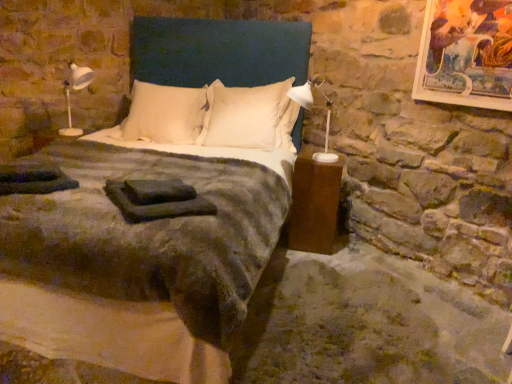
Image resolution: width=512 pixels, height=384 pixels. Describe the element at coordinates (163, 114) in the screenshot. I see `white soft pillow at center, the 1th pillow in the left-to-right sequence` at that location.

What do you see at coordinates (310, 108) in the screenshot? I see `white plastic lamp at right, the 2th bedside lamp from the left` at bounding box center [310, 108].

Describe the element at coordinates (466, 54) in the screenshot. This screenshot has height=384, width=512. I see `metallic gold picture frame at upper right` at that location.

The height and width of the screenshot is (384, 512). In order to click on velvet dark green bed at center in this screenshot , I will do `click(135, 264)`.

Where is `white soft pillow at center, the 1th pillow in the left-to-right sequence`? This screenshot has width=512, height=384. white soft pillow at center, the 1th pillow in the left-to-right sequence is located at coordinates (163, 114).

Would you consider brown matte nightstand at right to be distant from metallic gold picture frame at upper right?

Yes, brown matte nightstand at right is far from metallic gold picture frame at upper right.

Consider the image. Is metallic gold picture frame at upper right completely or partially inside brown matte nightstand at right?

No, metallic gold picture frame at upper right is not inside brown matte nightstand at right.

Who is bigger, brown matte nightstand at right or metallic gold picture frame at upper right?

brown matte nightstand at right.

How far apart are brown matte nightstand at right and metallic gold picture frame at upper right?

They are 1.01 meters apart.

Who is shorter, metallic gold picture frame at upper right or white plastic lamp at right, the 2th bedside lamp from the left?

white plastic lamp at right, the 2th bedside lamp from the left.

The height and width of the screenshot is (384, 512). Identify the location of picture frame above the white plastic lamp at right, the 2th bedside lamp from the left (from the image's perspective). (x=466, y=54).

Is point (416, 89) farther from camera compared to point (325, 154)?

No, (416, 89) is in front of (325, 154).

Who is more distant, brown matte nightstand at right or dark green fabric at center?

Positioned behind is brown matte nightstand at right.

What are the coordinates of `nightstand behind the dark green fabric at center` in the screenshot? It's located at (315, 204).

From a real-world perspective, is brown matte nightstand at right above or below dark green fabric at center?

In terms of real-world spatial position, brown matte nightstand at right is below dark green fabric at center.

Is brown matte nightstand at right bigger than dark green fabric at center?

Yes, brown matte nightstand at right is bigger than dark green fabric at center.

Which object is positioned more to the left, white plastic lamp at left, placed as the 1th bedside lamp when sorted from left to right, or white soft pillow at center, which is the 2th pillow in left-to-right order?

white plastic lamp at left, placed as the 1th bedside lamp when sorted from left to right.

Is white plastic lamp at left, the 2th bedside lamp from the right, next to white soft pillow at center, which is the 2th pillow in left-to-right order, and touching it?

No, white plastic lamp at left, the 2th bedside lamp from the right, is not making contact with white soft pillow at center, which is the 2th pillow in left-to-right order.

Considering the relative sizes of white plastic lamp at left, placed as the 1th bedside lamp when sorted from left to right, and white soft pillow at center, marked as the 1th pillow in a right-to-left arrangement, in the image provided, is white plastic lamp at left, placed as the 1th bedside lamp when sorted from left to right, taller than white soft pillow at center, marked as the 1th pillow in a right-to-left arrangement,?

In fact, white plastic lamp at left, placed as the 1th bedside lamp when sorted from left to right, may be shorter than white soft pillow at center, marked as the 1th pillow in a right-to-left arrangement.

Is dark green fabric at center to the right of white soft pillow at center, marked as the 1th pillow in a right-to-left arrangement, from the viewer's perspective?

No, dark green fabric at center is not to the right of white soft pillow at center, marked as the 1th pillow in a right-to-left arrangement.

From a real-world perspective, which is physically above, dark green fabric at center or white soft pillow at center, marked as the 1th pillow in a right-to-left arrangement?

From a 3D spatial view, white soft pillow at center, marked as the 1th pillow in a right-to-left arrangement, is above.

Starting from the dark green fabric at center, which pillow is the 1st one behind? Please provide its 2D coordinates.

[(250, 117)]

Does point (116, 203) lie in front of point (240, 129)?

Yes.

Is brown matte nightstand at right not close to velvet dark green bed at center?

They are positioned close to each other.

Considering the relative sizes of brown matte nightstand at right and velvet dark green bed at center in the image provided, is brown matte nightstand at right bigger than velvet dark green bed at center?

Actually, brown matte nightstand at right might be smaller than velvet dark green bed at center.

Is brown matte nightstand at right not within velvet dark green bed at center?

No, brown matte nightstand at right is inside or overlapping with velvet dark green bed at center.

Which is more to the left, white soft pillow at center, marked as the 2th pillow in a right-to-left arrangement, or dark blue fabric headboard at center?

white soft pillow at center, marked as the 2th pillow in a right-to-left arrangement.

Is white soft pillow at center, marked as the 2th pillow in a right-to-left arrangement, oriented away from dark blue fabric headboard at center?

That's not correct — white soft pillow at center, marked as the 2th pillow in a right-to-left arrangement, is not looking away from dark blue fabric headboard at center.

From the image's perspective, is white soft pillow at center, marked as the 2th pillow in a right-to-left arrangement, positioned above or below dark blue fabric headboard at center?

Based on their image positions, white soft pillow at center, marked as the 2th pillow in a right-to-left arrangement, is located above dark blue fabric headboard at center.

Does point (196, 140) appear closer or farther from the camera than point (246, 33)?

Point (196, 140) is closer to the camera than point (246, 33).

The width and height of the screenshot is (512, 384). I want to click on nightstand below the metallic gold picture frame at upper right (from the image's perspective), so click(315, 204).

You are a GUI agent. You are given a task and a screenshot of the screen. Output one action in this format:
    pyautogui.click(x=<x>, y=<y>)
    Task: Click on the picture frame on the right of white plastic lamp at right, the 2th bedside lamp from the left
    The image size is (512, 384).
    Given the screenshot: What is the action you would take?
    pyautogui.click(x=466, y=54)

Based on their spatial positions, is dark green fabric at center or metallic gold picture frame at upper right closer to dark blue fabric headboard at center?

metallic gold picture frame at upper right is closer to dark blue fabric headboard at center.

From the image, which object appears to be farther from metallic gold picture frame at upper right, velvet dark green bed at center or brown matte nightstand at right?

velvet dark green bed at center is further to metallic gold picture frame at upper right.

Estimate the real-world distances between objects in this image. Which object is further from brown matte nightstand at right, dark green fabric at center or metallic gold picture frame at upper right?

dark green fabric at center is further to brown matte nightstand at right.

Considering their positions, is brown matte nightstand at right positioned further to white plastic lamp at left, placed as the 1th bedside lamp when sorted from left to right, than metallic gold picture frame at upper right?

Among the two, metallic gold picture frame at upper right is located further to white plastic lamp at left, placed as the 1th bedside lamp when sorted from left to right.

Looking at the image, which one is located closer to white plastic lamp at right, the 2th bedside lamp from the left, velvet dark green bed at center or white soft pillow at center, marked as the 2th pillow in a right-to-left arrangement?

white soft pillow at center, marked as the 2th pillow in a right-to-left arrangement, lies closer to white plastic lamp at right, the 2th bedside lamp from the left, than the other object.

Looking at the image, which one is located further to white soft pillow at center, marked as the 2th pillow in a right-to-left arrangement, dark green fabric at center or white plastic lamp at right, the 2th bedside lamp from the left?

Among the two, dark green fabric at center is located further to white soft pillow at center, marked as the 2th pillow in a right-to-left arrangement.

From the image, which object appears to be nearer to velvet dark green bed at center, metallic gold picture frame at upper right or dark blue fabric headboard at center?

The object closer to velvet dark green bed at center is dark blue fabric headboard at center.

Which object lies nearer to the anchor point white soft pillow at center, which is the 2th pillow in left-to-right order, white soft pillow at center, marked as the 2th pillow in a right-to-left arrangement, or white plastic lamp at right, the 1th bedside lamp when ordered from right to left?

white soft pillow at center, marked as the 2th pillow in a right-to-left arrangement.

Where is `pillow between dark blue fabric headboard at center and brown matte nightstand at right in the vertical direction`? The height and width of the screenshot is (384, 512). pillow between dark blue fabric headboard at center and brown matte nightstand at right in the vertical direction is located at coordinates (250, 117).

Where is `material located between velvet dark green bed at center and brown matte nightstand at right in the depth direction`? This screenshot has width=512, height=384. material located between velvet dark green bed at center and brown matte nightstand at right in the depth direction is located at coordinates (156, 199).

Identify the location of material between white plastic lamp at left, placed as the 1th bedside lamp when sorted from left to right, and white plastic lamp at right, the 2th bedside lamp from the left, from left to right. pos(156,199).

Identify the location of headboard between white plastic lamp at left, placed as the 1th bedside lamp when sorted from left to right, and white plastic lamp at right, the 2th bedside lamp from the left, in the horizontal direction. coord(218,51).